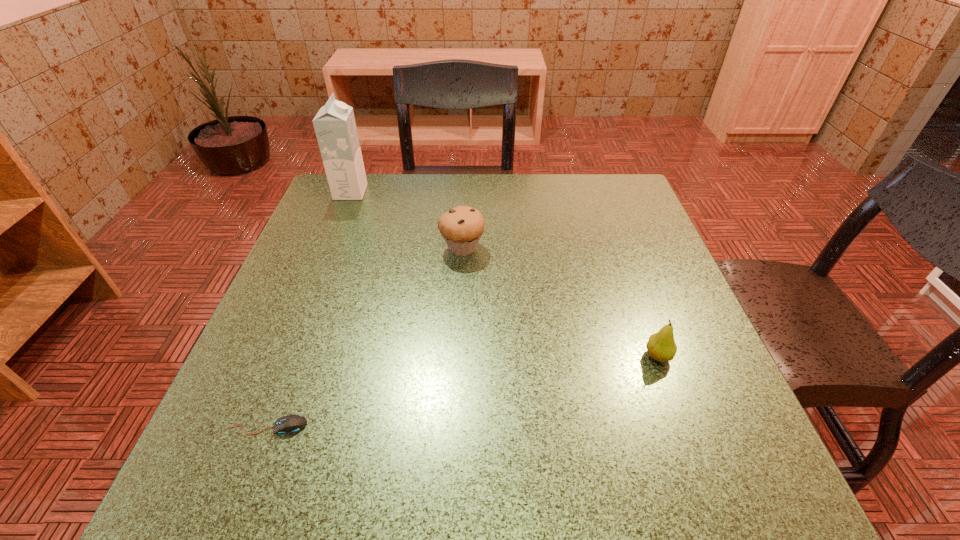
The width and height of the screenshot is (960, 540). I want to click on vacant area that lies between the shortest object and the muffin, so click(366, 337).

This screenshot has height=540, width=960. Identify the location of blank region between the shortest object and the third farthest object. (464, 391).

Locate an element on the screen. The width and height of the screenshot is (960, 540). free space between the second nearest object and the tallest object is located at coordinates pos(504,274).

Locate an element on the screen. free space between the tallest object and the rightmost object is located at coordinates (504, 274).

Find the location of `free space between the rightmost object and the mouse`. free space between the rightmost object and the mouse is located at coordinates (464, 391).

The image size is (960, 540). Find the location of `object that is the second closest to the shortest object`. object that is the second closest to the shortest object is located at coordinates (661, 346).

The height and width of the screenshot is (540, 960). I want to click on the closest object to the third object from left to right, so click(x=335, y=127).

Find the location of a particular element. free space that satisfies the following two spatial constraints: 1. on the front label of the nearest object; 2. on the left side of the carton is located at coordinates (258, 426).

I want to click on vacant area that satisfies the following two spatial constraints: 1. on the front label of the third farthest object; 2. on the left side of the tallest object, so click(x=286, y=356).

I want to click on vacant position in the image that satisfies the following two spatial constraints: 1. on the front label of the carton; 2. on the right side of the third object from left to right, so click(328, 248).